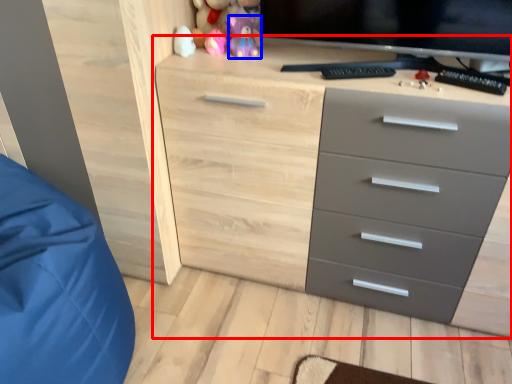
Question: Among these objects, which one is farthest to the camera, chest of drawers (highlighted by a red box) or toy (highlighted by a blue box)?

Choices:
 (A) chest of drawers
 (B) toy

Answer: (B)